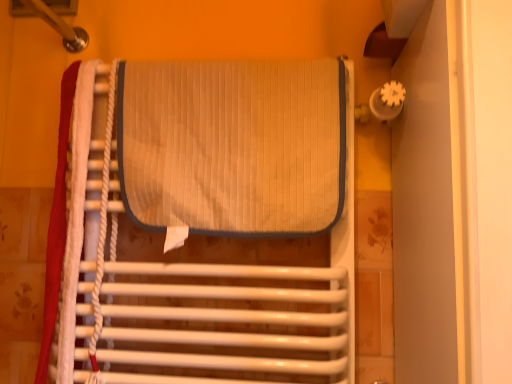
Question: Does white rope at left have a greater width compared to beige textured mat at center?

Choices:
 (A) yes
 (B) no

Answer: (B)

Question: Considering the relative sizes of white rope at left and beige textured mat at center in the image provided, is white rope at left taller than beige textured mat at center?

Choices:
 (A) no
 (B) yes

Answer: (B)

Question: Considering the relative positions of white rope at left and beige textured mat at center in the image provided, is white rope at left behind beige textured mat at center?

Choices:
 (A) no
 (B) yes

Answer: (B)

Question: Is white rope at left oriented towards beige textured mat at center?

Choices:
 (A) yes
 (B) no

Answer: (A)

Question: Would you say white rope at left is outside beige textured mat at center?

Choices:
 (A) yes
 (B) no

Answer: (B)

Question: Is point 91,264 closer or farther from the camera than point 128,145?

Choices:
 (A) farther
 (B) closer

Answer: (A)

Question: Considering the positions of textured beige mat at center and beige textured mat at center in the image, is textured beige mat at center bigger or smaller than beige textured mat at center?

Choices:
 (A) big
 (B) small

Answer: (A)

Question: Considering the positions of textured beige mat at center and beige textured mat at center in the image, is textured beige mat at center wider or thinner than beige textured mat at center?

Choices:
 (A) thin
 (B) wide

Answer: (B)

Question: In the image, is textured beige mat at center on the left side or the right side of beige textured mat at center?

Choices:
 (A) right
 (B) left

Answer: (A)

Question: In terms of size, does white rope at left appear bigger or smaller than textured beige mat at center?

Choices:
 (A) small
 (B) big

Answer: (A)

Question: Would you say white rope at left is to the left or to the right of textured beige mat at center in the picture?

Choices:
 (A) right
 (B) left

Answer: (B)

Question: Considering the positions of white rope at left and textured beige mat at center in the image, is white rope at left taller or shorter than textured beige mat at center?

Choices:
 (A) short
 (B) tall

Answer: (A)

Question: Relative to textured beige mat at center, is white rope at left in front or behind?

Choices:
 (A) behind
 (B) front

Answer: (A)

Question: From the image's perspective, is beige textured mat at center above or below textured beige mat at center?

Choices:
 (A) below
 (B) above

Answer: (B)

Question: Does point (286, 190) appear closer or farther from the camera than point (186, 147)?

Choices:
 (A) farther
 (B) closer

Answer: (B)